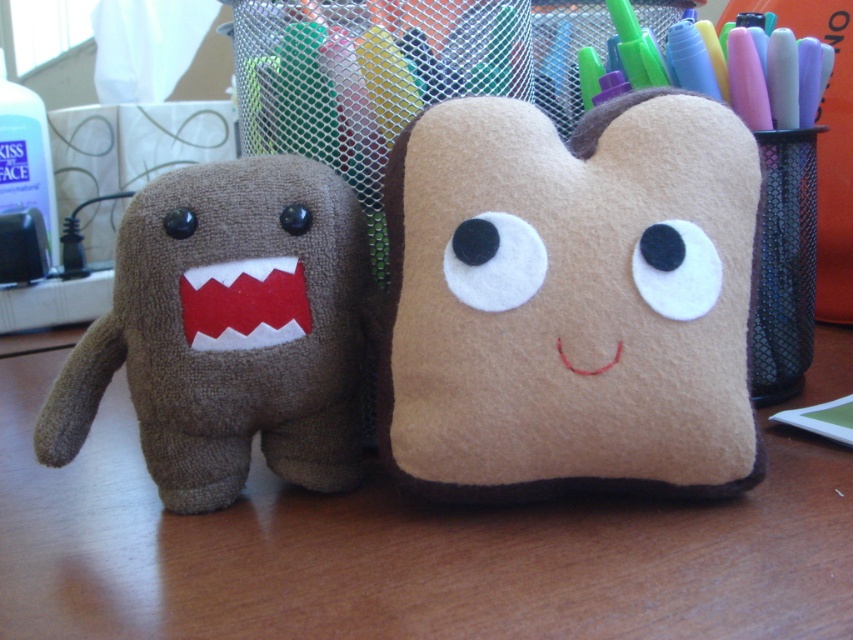
You are organizing a childrens party and have both the felt plushie at center and the brown plush toy at left. If you want to choose the bigger one to give as a prize, which one should you pick?

The felt plushie at center is larger in size than the brown plush toy at left, so you should choose the felt plushie at center as the prize.

You are organizing a desk and see the brown plush toy at left and the clear plastic bottle at left. Which object is positioned lower on the desk?

The brown plush toy at left is positioned lower than the clear plastic bottle at left, so it is the lower object.